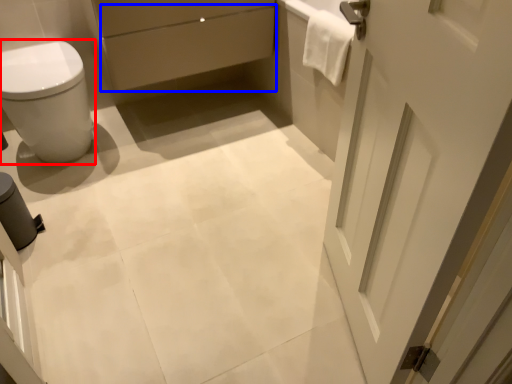
Question: Which point is closer to the camera, bidet (highlighted by a red box) or drawer (highlighted by a blue box)?

Choices:
 (A) bidet
 (B) drawer

Answer: (A)